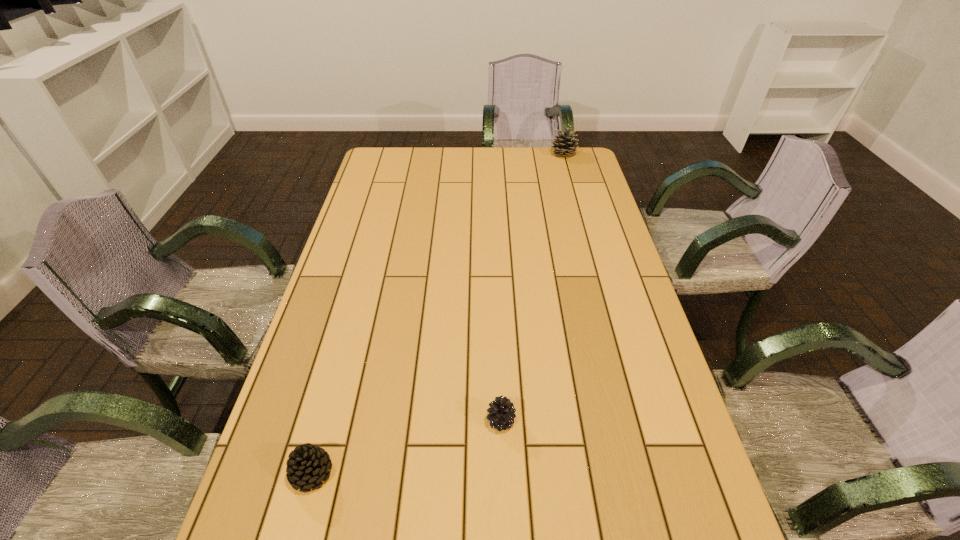
This screenshot has width=960, height=540. What are the coordinates of `the farthest pinecone` in the screenshot? It's located at (564, 146).

Locate an element on the screen. the tallest pinecone is located at coordinates (564, 146).

Where is `the leftmost object`? the leftmost object is located at coordinates (308, 465).

The height and width of the screenshot is (540, 960). Find the location of `the leftmost pinecone`. the leftmost pinecone is located at coordinates (308, 465).

I want to click on the second pinecone from left to right, so click(x=501, y=415).

At what (x,y) coordinates should I click in order to perform the action: click on the second farthest object. Please return your answer as a coordinate pair (x, y). Looking at the image, I should click on (501, 415).

The height and width of the screenshot is (540, 960). Identify the location of blank space located on the front of the rightmost pinecone. (578, 207).

Find the location of a particular element. The width and height of the screenshot is (960, 540). vacant space located on the left of the second object from right to left is located at coordinates (459, 421).

The height and width of the screenshot is (540, 960). I want to click on object present at the far edge, so click(x=564, y=146).

The height and width of the screenshot is (540, 960). I want to click on object present at the left edge, so click(308, 465).